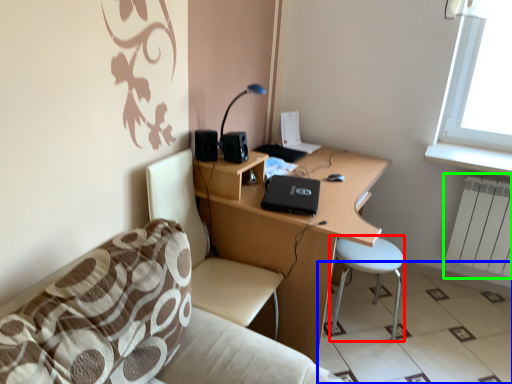
Question: Which is nearer to the bar stool (highlighted by a red box)? tile (highlighted by a blue box) or radiator (highlighted by a green box).

Choices:
 (A) tile
 (B) radiator

Answer: (A)